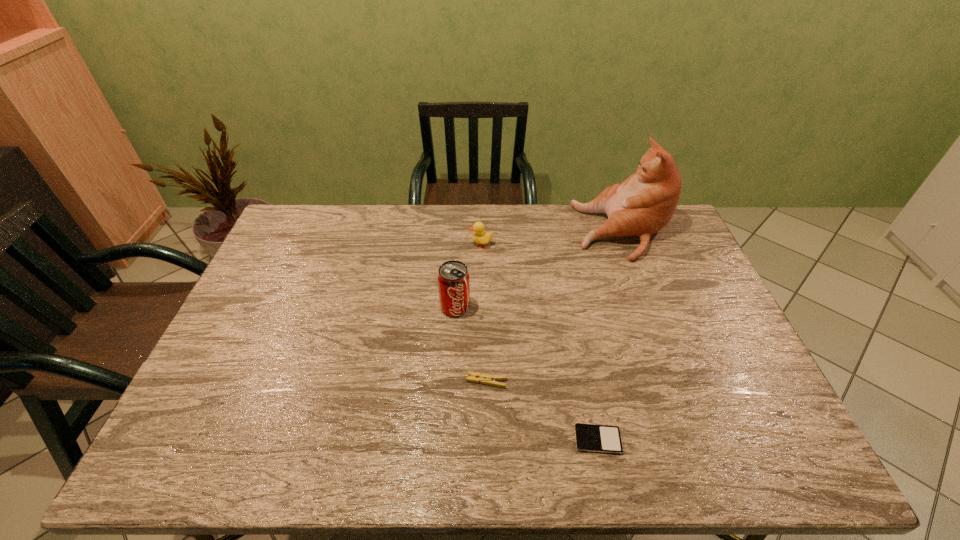
The image size is (960, 540). Find the location of `the rightmost object`. the rightmost object is located at coordinates (643, 204).

I want to click on the tallest object, so click(x=643, y=204).

Locate an element on the screen. This screenshot has width=960, height=540. the second tallest object is located at coordinates (453, 278).

Where is `the third nearest object`? the third nearest object is located at coordinates (453, 278).

The width and height of the screenshot is (960, 540). I want to click on the third shortest object, so click(480, 237).

At what (x,y) coordinates should I click in order to perform the action: click on the fourth tallest object. Please return your answer as a coordinate pair (x, y). The image size is (960, 540). Looking at the image, I should click on (475, 377).

In order to click on the fourth farthest object in this screenshot , I will do `click(475, 377)`.

Locate an element on the screen. The image size is (960, 540). the nearest object is located at coordinates (589, 437).

You are a GUI agent. You are given a task and a screenshot of the screen. Output one action in this format:
    pyautogui.click(x=<x>, y=<y>)
    Task: Click on the shortest object
    This screenshot has width=960, height=540.
    Given the screenshot: What is the action you would take?
    pyautogui.click(x=589, y=437)

Image resolution: width=960 pixels, height=540 pixels. Find the location of `vacant space located 0.380m on the face of the rightmost object`. vacant space located 0.380m on the face of the rightmost object is located at coordinates (470, 232).